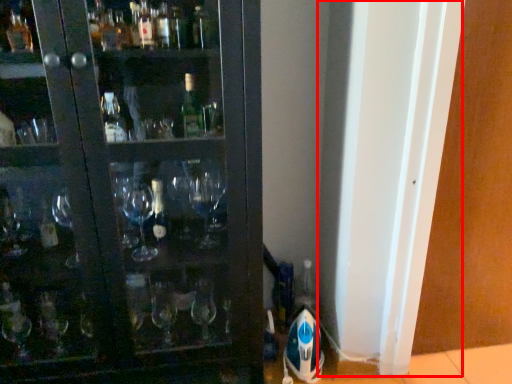
Question: From the image's perspective, what is the correct spatial relationship of screen door (annotated by the red box) in relation to screen door?

Choices:
 (A) above
 (B) below

Answer: (B)